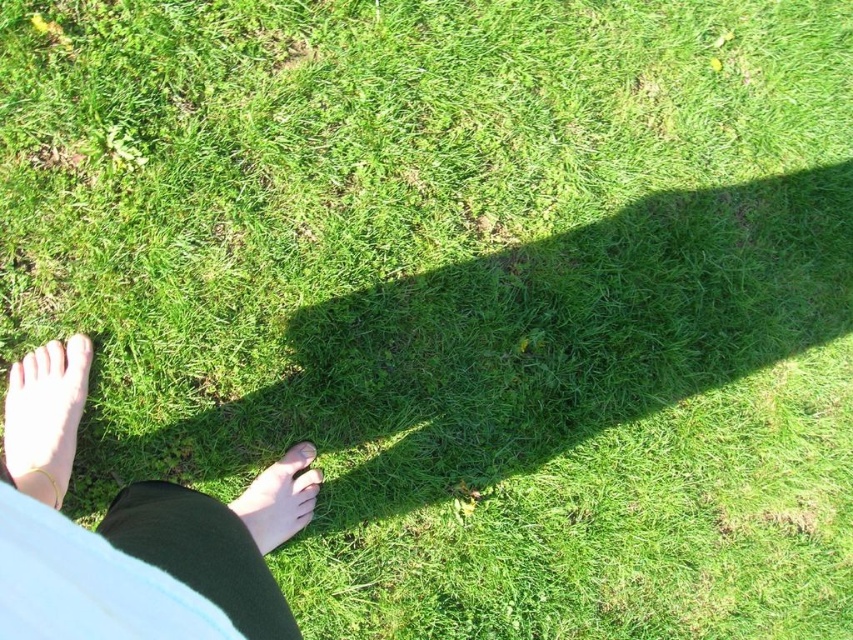
Question: Does skinny barefoot feet at lower left have a greater width compared to gold metallic bracelet at lower left?

Choices:
 (A) yes
 (B) no

Answer: (A)

Question: Is gold metallic bracelet at lower left thinner than smooth skin foot at lower center?

Choices:
 (A) no
 (B) yes

Answer: (B)

Question: Which point appears farthest from the camera in this image?

Choices:
 (A) (15, 388)
 (B) (62, 628)
 (C) (296, 458)

Answer: (C)

Question: Is skinny barefoot feet at lower left below gold metallic bracelet at lower left?

Choices:
 (A) no
 (B) yes

Answer: (B)

Question: Which object appears farthest from the camera in this image?

Choices:
 (A) smooth skin foot at lower center
 (B) gold metallic bracelet at lower left

Answer: (A)

Question: Which object is farther from the camera taking this photo?

Choices:
 (A) skinny barefoot feet at lower left
 (B) gold metallic bracelet at lower left
 (C) smooth skin foot at lower center

Answer: (C)